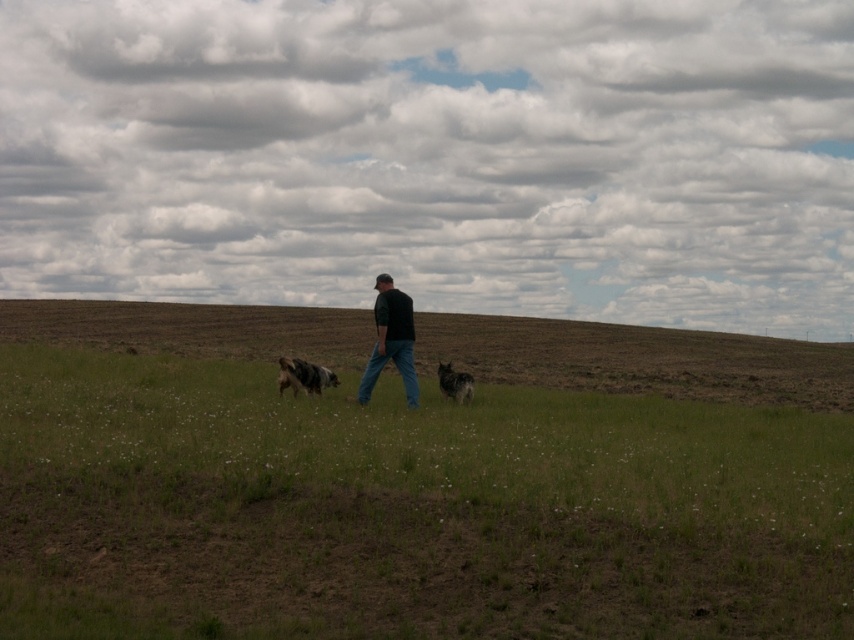
Question: Can you confirm if brown grassland at center is positioned to the left of spotted fur dog at center?

Choices:
 (A) yes
 (B) no

Answer: (B)

Question: Which point is closer to the camera taking this photo?

Choices:
 (A) (316, 390)
 (B) (398, 305)
 (C) (452, 372)

Answer: (B)

Question: Which object appears closest to the camera in this image?

Choices:
 (A) spotted fur dog at center
 (B) dark gray fur at center

Answer: (A)

Question: Is dark green shirt at center closer to the viewer compared to spotted fur dog at center?

Choices:
 (A) no
 (B) yes

Answer: (B)

Question: Can you confirm if dark green shirt at center is thinner than spotted fur dog at center?

Choices:
 (A) yes
 (B) no

Answer: (B)

Question: Estimate the real-world distances between objects in this image. Which object is farther from the dark green shirt at center?

Choices:
 (A) dark gray fur at center
 (B) spotted fur dog at center
 (C) brown grassland at center
 (D) green grass at center

Answer: (C)